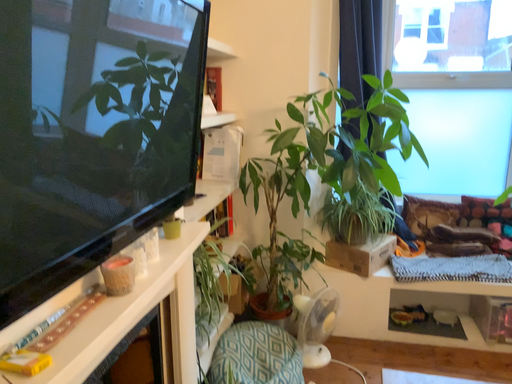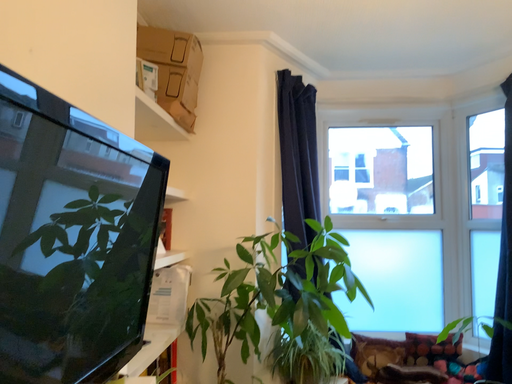
Question: How did the camera likely rotate when shooting the video?

Choices:
 (A) rotated upward
 (B) rotated downward

Answer: (A)